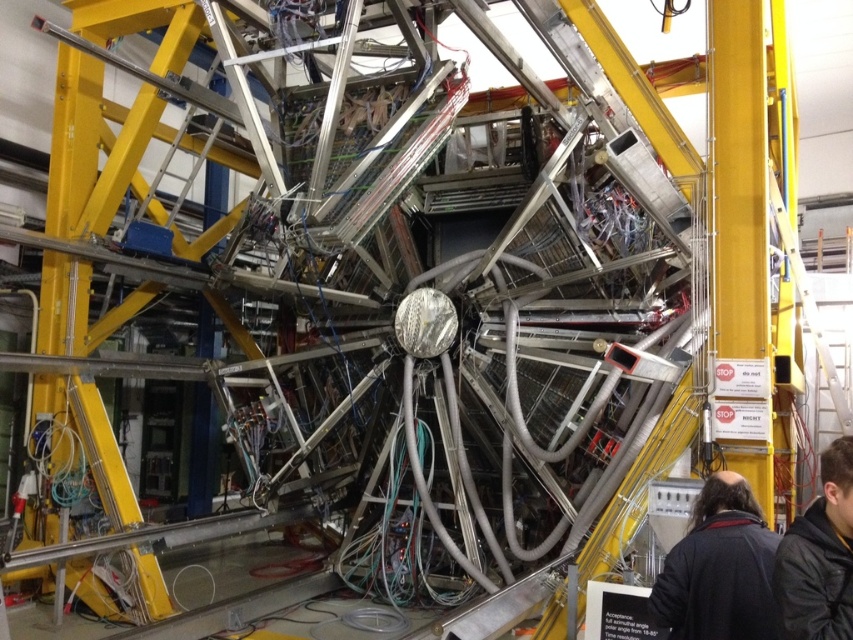
Question: Which object appears closest to the camera in this image?

Choices:
 (A) yellow metallic ladder at left
 (B) black jacket at lower right
 (C) dark brown leather jacket at lower right

Answer: (B)

Question: Does yellow metallic ladder at left appear on the right side of dark brown leather jacket at lower right?

Choices:
 (A) no
 (B) yes

Answer: (A)

Question: Which point appears closest to the camera in this image?

Choices:
 (A) (62, 176)
 (B) (817, 589)

Answer: (B)

Question: Is yellow metallic ladder at left below black jacket at lower right?

Choices:
 (A) no
 (B) yes

Answer: (A)

Question: Does yellow metallic ladder at left have a greater width compared to black jacket at lower right?

Choices:
 (A) no
 (B) yes

Answer: (B)

Question: Based on their relative distances, which object is nearer to the dark brown leather jacket at lower right?

Choices:
 (A) black jacket at lower right
 (B) yellow metallic ladder at left

Answer: (A)